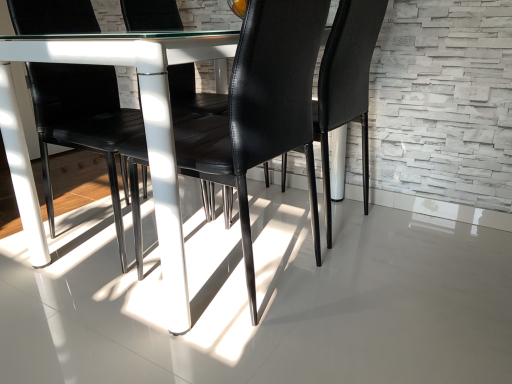
Where is `vacant space in front of black leather chair at center, arranged as the 2th chair when viewed from the back`? vacant space in front of black leather chair at center, arranged as the 2th chair when viewed from the back is located at coordinates (232, 355).